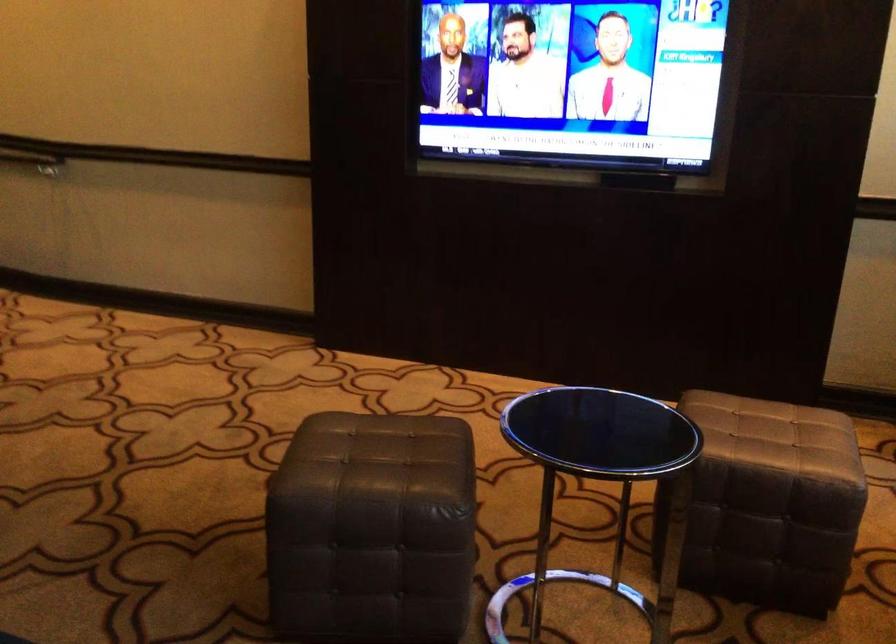
Locate an element on the screen. Image resolution: width=896 pixels, height=644 pixels. chair sitting surface is located at coordinates (600, 433).